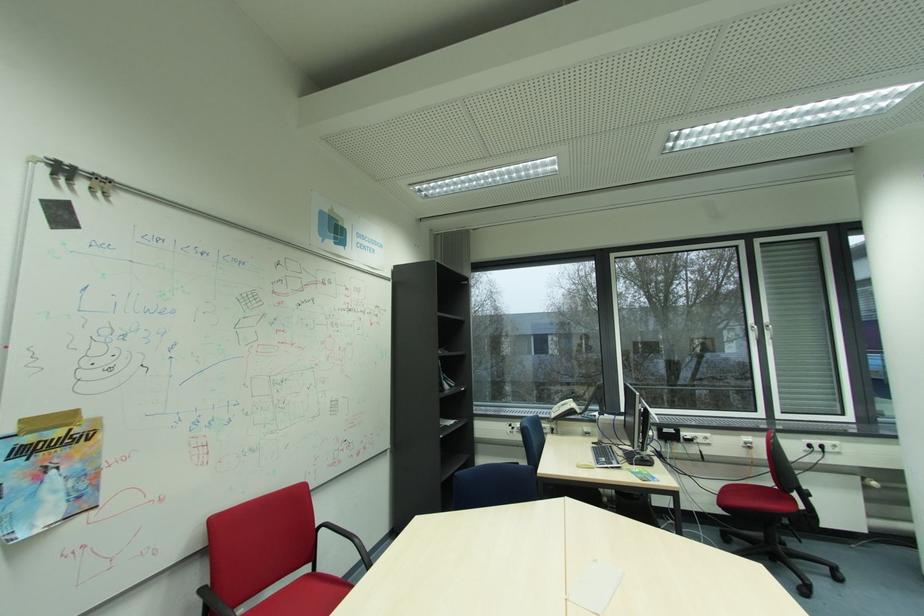
Locate an element on the screen. This screenshot has height=616, width=924. white notepad is located at coordinates (594, 586).